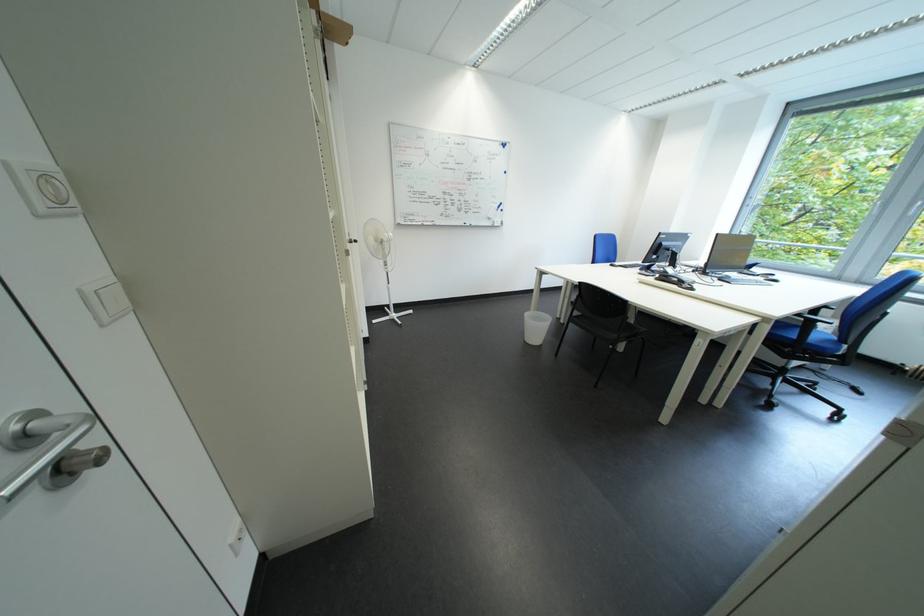
This screenshot has width=924, height=616. I want to click on silver door lock, so click(49, 450).